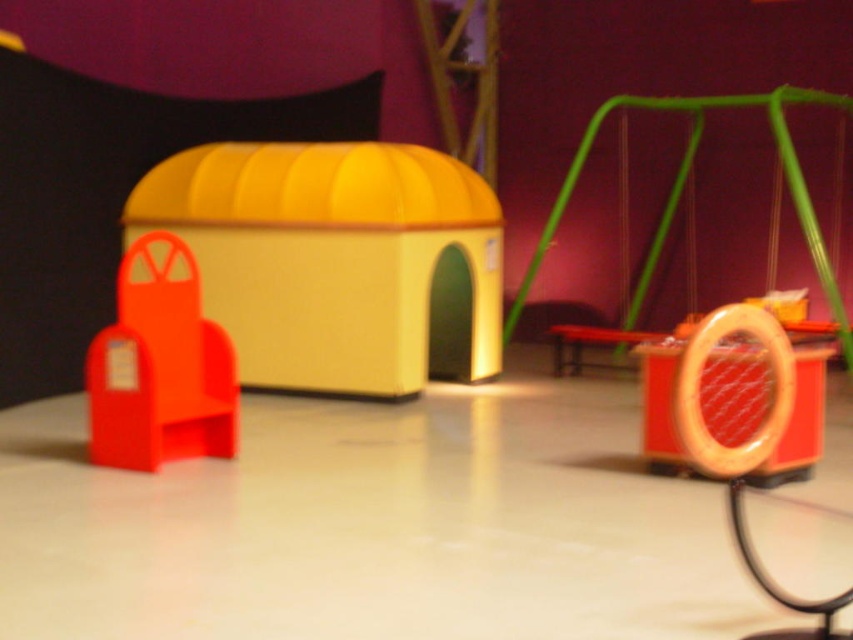
You are a tiny explorer standing in the miniature scene. You see the yellow matte plastic house at center and the matte orange stool at center. Which object is closer to you?

The yellow matte plastic house at center is closer to the viewer than the matte orange stool at center, so the yellow matte plastic house at center is closer to you.

You are organizing a small library shelf and have an orange matte bookend at left and a matte orange stool at center. Which object is narrower?

The orange matte bookend at left is narrower than the matte orange stool at center.

You are a toy character trying to reach the yellow matte plastic house at center from the matte orange stool at center. If you can jump 10 feet in one leap, will you be able to reach the house without needing to jump again?

The yellow matte plastic house at center and the matte orange stool at center are 9.27 feet apart from each other. Since your jump can cover 10 feet, you can reach the house in a single leap without needing to jump again.